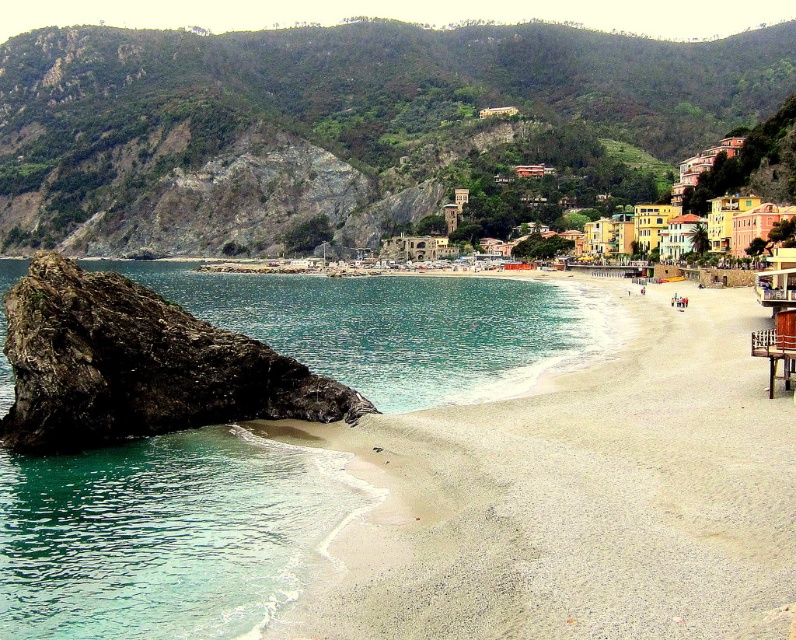
You are standing on the white sandy beach at lower left and want to climb up to the green rocky hillside at upper center. Based on the scene description, what challenge might you face due to their relative heights?

The green rocky hillside at upper center is taller than the white sandy beach at lower left, so climbing up might be difficult due to the elevation difference.

You are planning to set up a small tent for a beach picnic. Given the scene, which location between the green rocky hillside at upper center and the white sandy beach at lower left would be more suitable for setting up your tent?

The white sandy beach at lower left is more suitable for setting up a tent because the green rocky hillside at upper center is bigger and might be too uneven or rocky for a stable setup.

You are standing at the beach and see two points marked in the image. The first point is at coordinates point (373, 122) and the second is at point (588, 605). Which point is closer to you?

Point (373, 122) is further to the camera than point (588, 605), so the second point is closer to you.